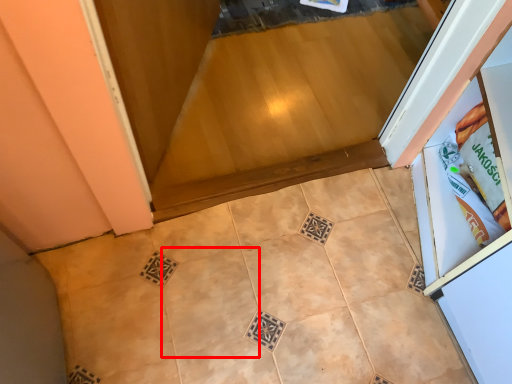
Question: From the image's perspective, what is the correct spatial relationship of ceramic tile (annotated by the red box) in relation to ceramic tile?

Choices:
 (A) above
 (B) below

Answer: (B)